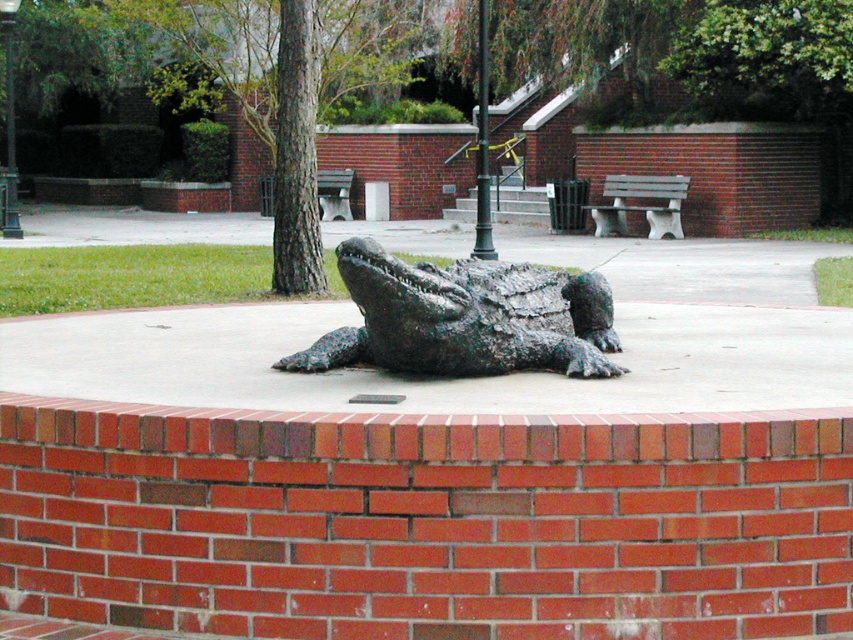
Which of these two, shiny bronze crocodile at center or wooden bench at center, stands taller?

Standing taller between the two is wooden bench at center.

Can you confirm if shiny bronze crocodile at center is positioned below wooden bench at center?

Yes.

Does point (602, 308) come closer to viewer compared to point (648, 180)?

Yes, it is.

Locate an element on the screen. shiny bronze crocodile at center is located at coordinates (465, 317).